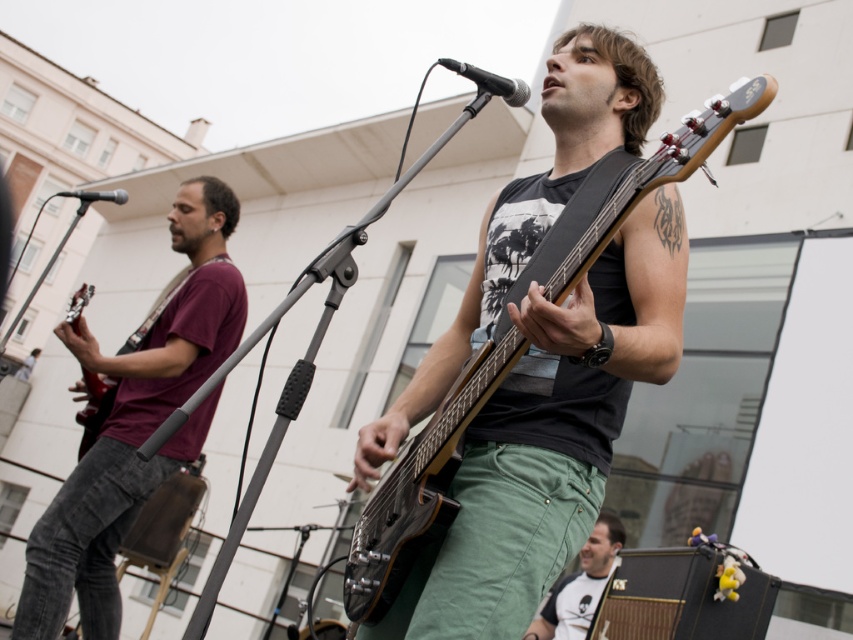
You are a photographer at the live music performance and need to capture a shot of the maroon cotton shirt at left. Where should you position yourself to ensure it is in the frame?

The maroon cotton shirt at left is located at point (135, 424), so you should position yourself to the left side of the scene to capture it in the frame.

Looking at this image, you are a photographer at the live music performance. You want to take a photo that includes both the maroon cotton shirt at left and the matte black guitar at center. Which object should be placed higher in the frame to ensure both are fully visible?

The maroon cotton shirt at left has a greater height compared to the matte black guitar at center, so to ensure both are fully visible in the photo, the maroon cotton shirt at left should be placed higher in the frame.